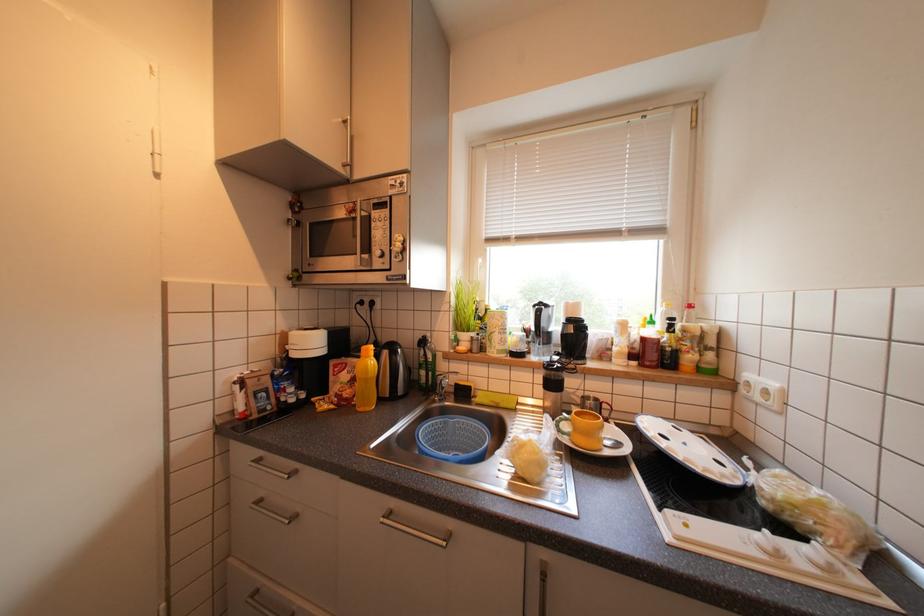
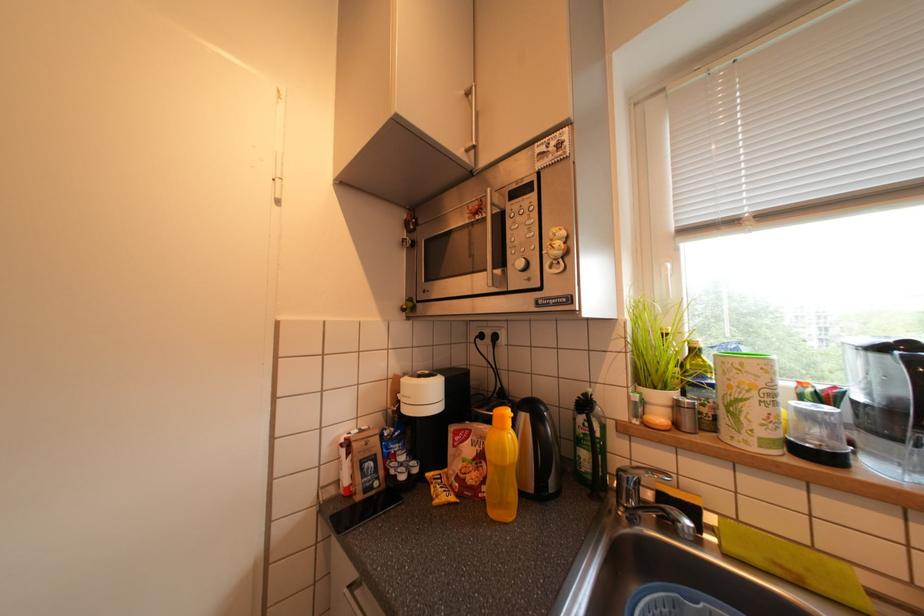
Question: The first image is from the beginning of the video and the second image is from the end. How did the camera likely rotate when shooting the video?

Choices:
 (A) Left
 (B) Right
 (C) Up
 (D) Down

Answer: (A)